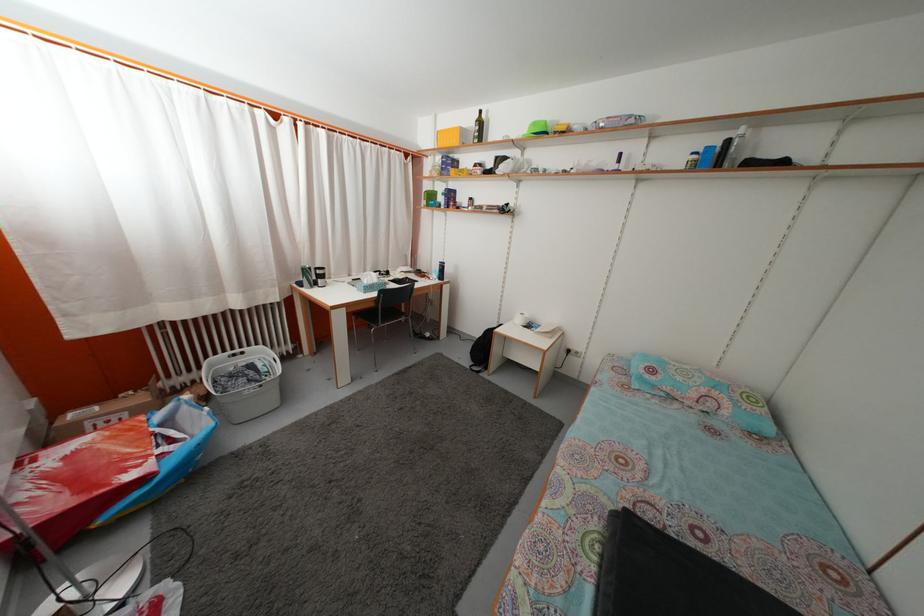
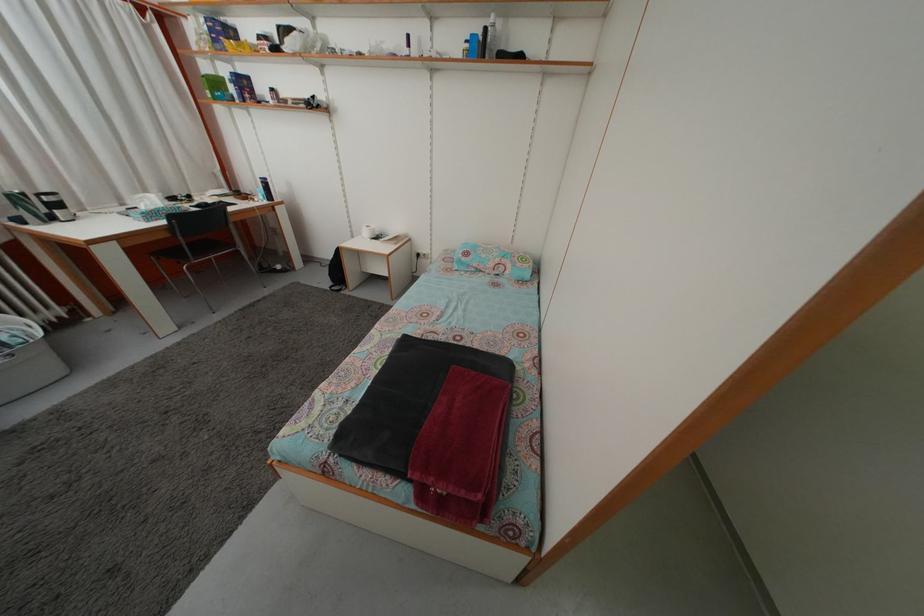
The point at (355, 283) is marked in the first image. Where is the corresponding point in the second image?

(128, 213)